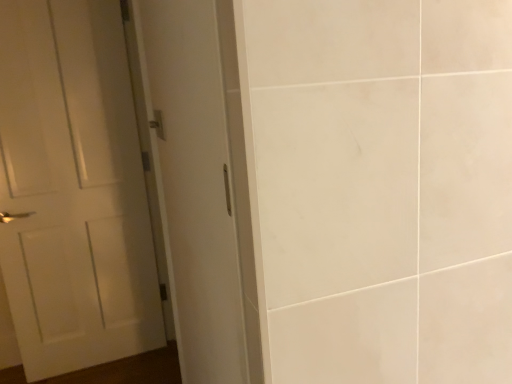
Question: From the image's perspective, is white matte door at left above or below white glossy door at left?

Choices:
 (A) below
 (B) above

Answer: (A)

Question: In terms of size, does white matte door at left appear bigger or smaller than white glossy door at left?

Choices:
 (A) big
 (B) small

Answer: (B)

Question: Considering the real-world distances, which object is farthest from the white matte door at left?

Choices:
 (A) metallic silver door handle at upper left
 (B) white glossy door at left

Answer: (A)

Question: Which is nearer to the white matte door at left?

Choices:
 (A) white glossy door at left
 (B) metallic silver door handle at upper left

Answer: (A)